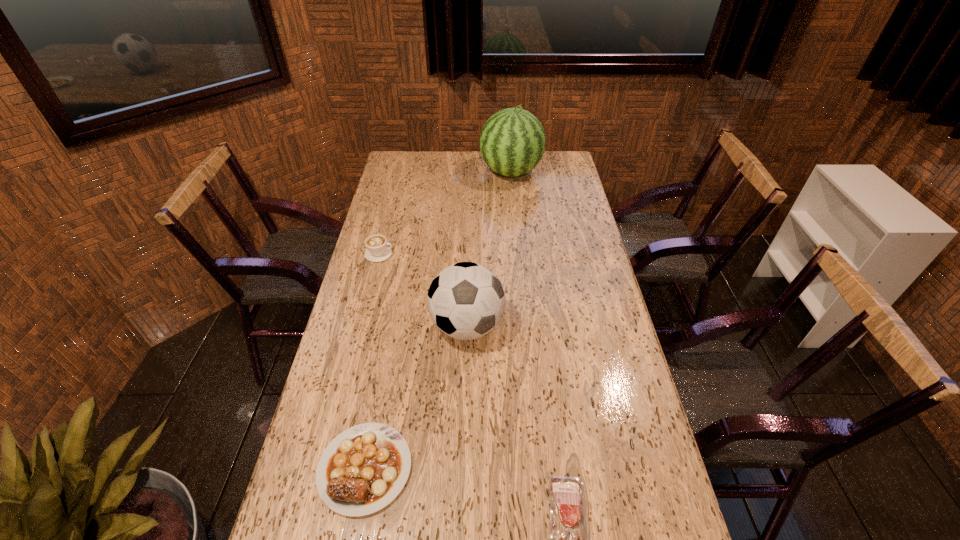
Where is `vacant space located 0.270m to the right of the second farthest object's handle`? The height and width of the screenshot is (540, 960). vacant space located 0.270m to the right of the second farthest object's handle is located at coordinates point(466,254).

At what (x,y) coordinates should I click in order to perform the action: click on vacant region located on the back of the taller steak. Please return your answer as a coordinate pair (x, y). This screenshot has width=960, height=540. Looking at the image, I should click on (381, 382).

Locate an element on the screen. This screenshot has height=540, width=960. object that is at the far edge is located at coordinates (512, 142).

I want to click on cappuccino that is at the left edge, so click(377, 250).

You are a GUI agent. You are given a task and a screenshot of the screen. Output one action in this format:
    pyautogui.click(x=<x>, y=<y>)
    Task: Click on the steak at the left edge
    This screenshot has height=540, width=960.
    Given the screenshot: What is the action you would take?
    pyautogui.click(x=363, y=469)

Where is `object that is at the right edge`? The height and width of the screenshot is (540, 960). object that is at the right edge is located at coordinates (512, 142).

Identify the location of object positioned at the far right corner. (512, 142).

Where is `vacant space at the far edge of the desktop`? The image size is (960, 540). vacant space at the far edge of the desktop is located at coordinates (534, 172).

Image resolution: width=960 pixels, height=540 pixels. Identify the location of free region at the left edge of the desktop. (389, 350).

The image size is (960, 540). Find the location of `blank space at the right edge`. blank space at the right edge is located at coordinates (637, 458).